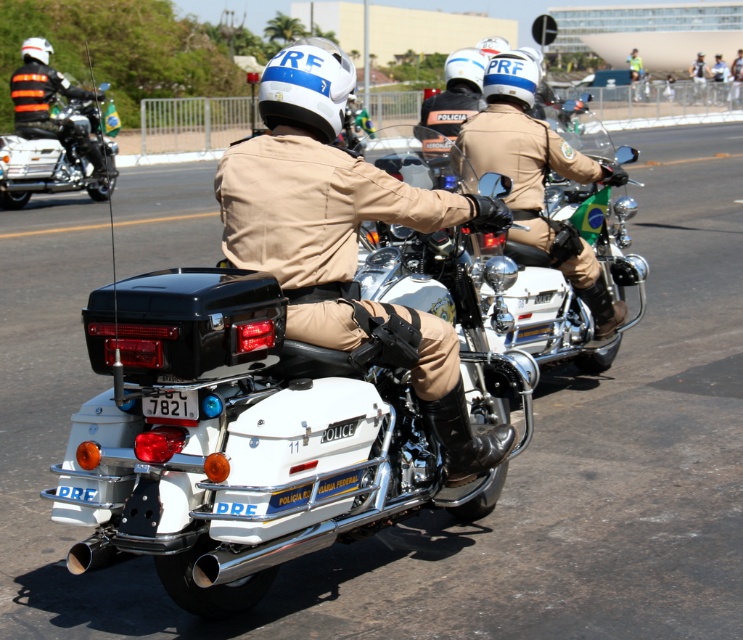
Question: Which point is closer to the camera taking this photo?

Choices:
 (A) (478, 410)
 (B) (1, 196)
 (C) (597, 272)

Answer: (A)

Question: Which of the following is the closest to the observer?

Choices:
 (A) (58, 166)
 (B) (400, 300)

Answer: (B)

Question: Which object is farther from the camera taking this photo?

Choices:
 (A) white metallic motorcycle at center
 (B) matte black motorcycle at left
 (C) matte black helmet at upper center

Answer: (B)

Question: Does white metallic motorcycle at center appear under matte black motorcycle at left?

Choices:
 (A) yes
 (B) no

Answer: (A)

Question: Does matte black helmet at upper center lie in front of matte black motorcycle at left?

Choices:
 (A) no
 (B) yes

Answer: (B)

Question: Is matte black helmet at upper center wider than matte black motorcycle at left?

Choices:
 (A) no
 (B) yes

Answer: (A)